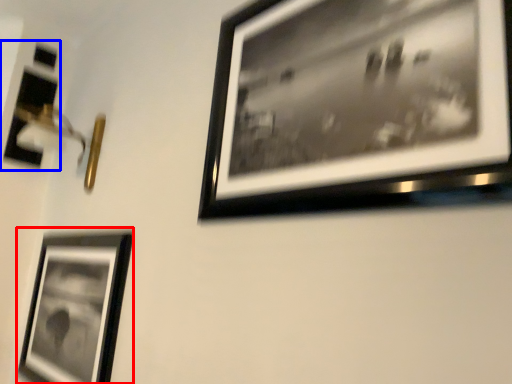
Question: Among these objects, which one is farthest to the camera, picture frame (highlighted by a red box) or picture frame (highlighted by a blue box)?

Choices:
 (A) picture frame
 (B) picture frame

Answer: (B)